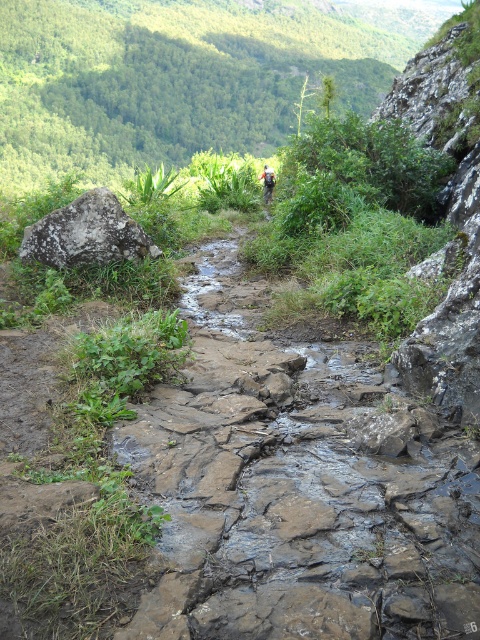
Which of these two, gray rough rock at left or camouflage fabric backpack at center, stands shorter?

Standing shorter between the two is gray rough rock at left.

Between point (144, 234) and point (267, 180), which one is positioned in front?

Point (144, 234) is in front.

What are the coordinates of `gray rough rock at left` in the screenshot? It's located at (86, 234).

Can you confirm if wet stone trail at center is positioned below camouflage fabric backpack at center?

Correct, wet stone trail at center is located below camouflage fabric backpack at center.

Does wet stone trail at center lie in front of camouflage fabric backpack at center?

That is True.

Is point (402, 627) positioned behind point (273, 186)?

No, it is in front of (273, 186).

The width and height of the screenshot is (480, 640). I want to click on wet stone trail at center, so click(x=298, y=488).

The image size is (480, 640). What do you see at coordinates (298, 488) in the screenshot?
I see `wet stone trail at center` at bounding box center [298, 488].

Is wet stone trail at center closer to camera compared to gray rough rock at left?

Yes, wet stone trail at center is closer to the viewer.

Between point (239, 541) and point (85, 260), which one is positioned behind?

Point (85, 260)

Where is `wet stone trail at center`? This screenshot has width=480, height=640. wet stone trail at center is located at coordinates (298, 488).